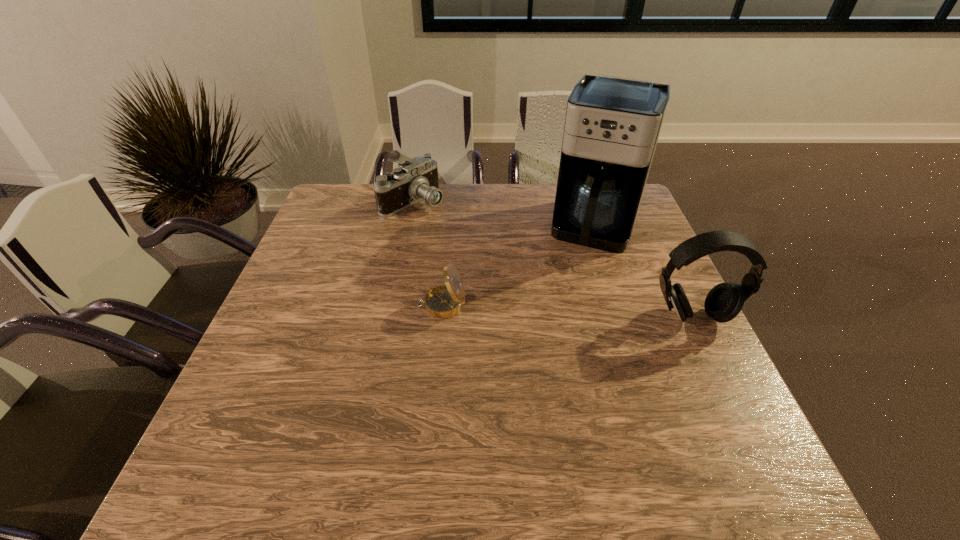
Locate an element on the screen. vacant region located 0.330m at the lens of the camera is located at coordinates (499, 268).

Where is `vacant space located on the front panel of the coffee maker`? The image size is (960, 540). vacant space located on the front panel of the coffee maker is located at coordinates (559, 336).

The image size is (960, 540). In order to click on vacant region located on the front panel of the coffee maker in this screenshot , I will do `click(581, 272)`.

Find the location of a particular element. vacant area situated 0.100m on the front panel of the coffee maker is located at coordinates (579, 279).

The width and height of the screenshot is (960, 540). Find the location of `camera at the far edge`. camera at the far edge is located at coordinates (415, 180).

Locate an element on the screen. Image resolution: width=960 pixels, height=540 pixels. coffee maker situated at the far edge is located at coordinates (612, 125).

Identify the location of earphone present at the right edge. (724, 301).

Find the location of a particular element. The image size is (960, 540). coffee maker at the right edge is located at coordinates (612, 125).

Locate an element on the screen. object that is at the far right corner is located at coordinates (612, 125).

Where is `free location at the far edge`? free location at the far edge is located at coordinates (541, 205).